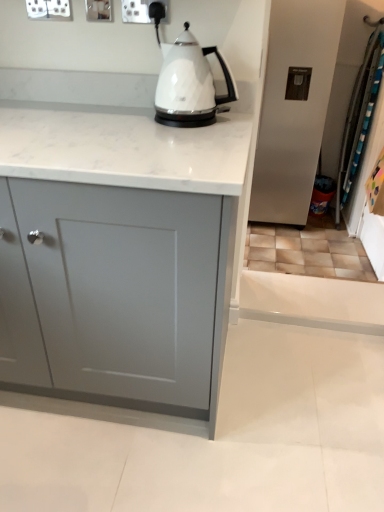
Find the location of `empty space that is to the right of matte gray cabinet at center`. empty space that is to the right of matte gray cabinet at center is located at coordinates (297, 402).